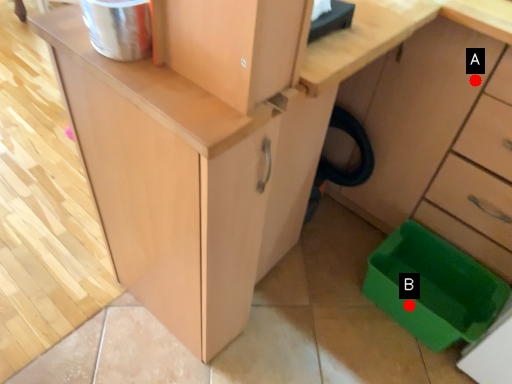
Question: Two points are circled on the image, labeled by A and B beside each circle. Which point is further to the camera?

Choices:
 (A) A is further
 (B) B is further

Answer: (B)